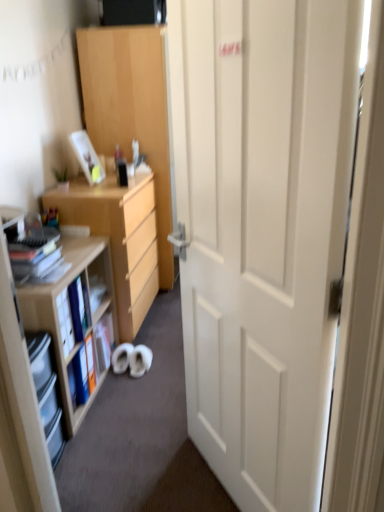
Question: Considering their positions, is light wood cabinet at center located in front of or behind matte plastic picture frame at upper left?

Choices:
 (A) behind
 (B) front

Answer: (A)

Question: From a real-world perspective, is light wood cabinet at center physically located above or below matte plastic picture frame at upper left?

Choices:
 (A) above
 (B) below

Answer: (B)

Question: Estimate the real-world distances between objects in this image. Which object is farther from the matte plastic picture frame at upper left?

Choices:
 (A) light wood cabinet at center
 (B) white matte door at center
 (C) clear plastic shelves at left, positioned as the second shelf in back-to-front order
 (D) green matte plant at upper left
 (E) wooden bookshelf at left, positioned as the first shelf in back-to-front order

Answer: (B)

Question: Which object is positioned farthest from the white matte door at center?

Choices:
 (A) light wood cabinet at center
 (B) green matte plant at upper left
 (C) matte plastic picture frame at upper left
 (D) matte black book at left
 (E) light brown wooden desk at left

Answer: (A)